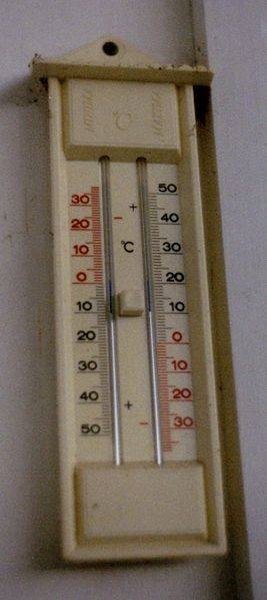
Locate an element on the screen. Image resolution: width=267 pixels, height=600 pixels. thermometer is located at coordinates (124, 183).